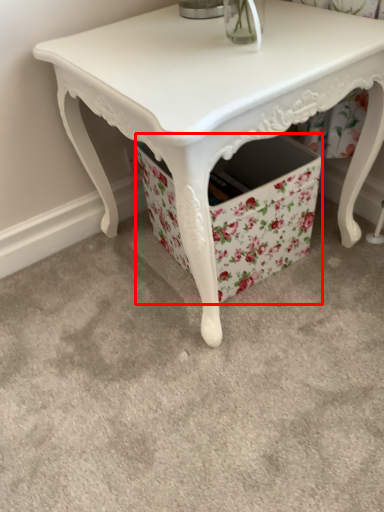
Question: From the image's perspective, considering the relative positions of storage box (annotated by the red box) and table in the image provided, where is storage box (annotated by the red box) located with respect to the staircase?

Choices:
 (A) below
 (B) above

Answer: (A)